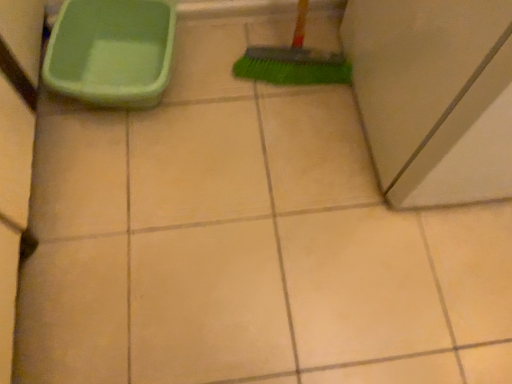
Where is `free space underneath green plastic bucket at upper left (from a real-world perspective)`? free space underneath green plastic bucket at upper left (from a real-world perspective) is located at coordinates (131, 66).